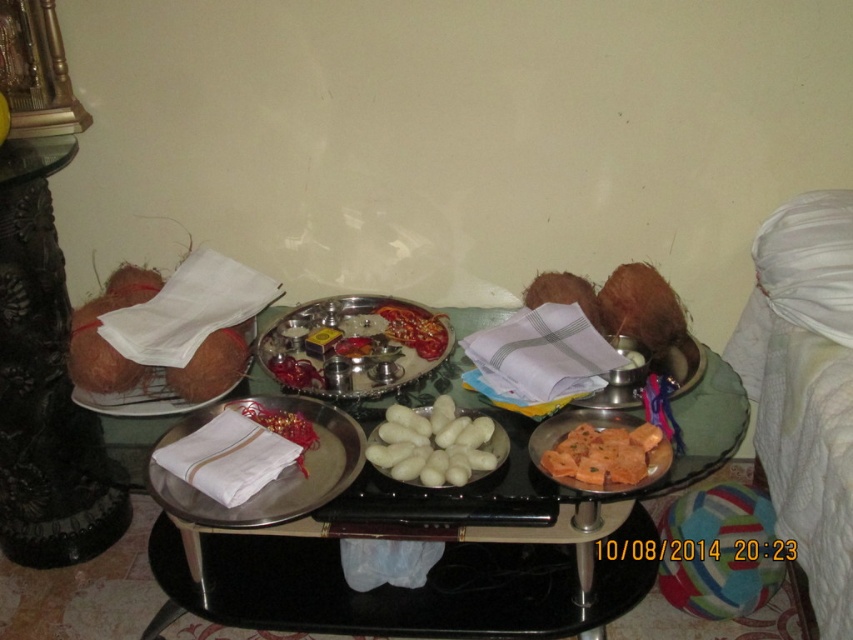
The height and width of the screenshot is (640, 853). What do you see at coordinates (433, 566) in the screenshot?
I see `metallic silver tray at center` at bounding box center [433, 566].

Image resolution: width=853 pixels, height=640 pixels. I want to click on metallic silver tray at center, so click(x=433, y=566).

The height and width of the screenshot is (640, 853). What are the coordinates of `metallic silver tray at center` in the screenshot? It's located at (433, 566).

I want to click on orange matte fried snack at center, so point(607,456).

Which is more to the right, orange matte fried snack at center or coconut shell at left?

From the viewer's perspective, orange matte fried snack at center appears more on the right side.

Between point (579, 468) and point (90, 406), which one is positioned in front?

Point (579, 468)

The image size is (853, 640). Find the location of `orange matte fried snack at center`. orange matte fried snack at center is located at coordinates (607, 456).

Between metallic silver tray at center and silver metallic tray at center, which one has less height?

silver metallic tray at center

Between point (633, 513) and point (368, 356), which one is positioned in front?

Point (368, 356) is in front.

Who is more forward, (343, 516) or (321, 314)?

Point (343, 516)

At what (x,y) coordinates should I click in order to perform the action: click on metallic silver tray at center. Please return your answer as a coordinate pair (x, y). This screenshot has width=853, height=640. Looking at the image, I should click on (433, 566).